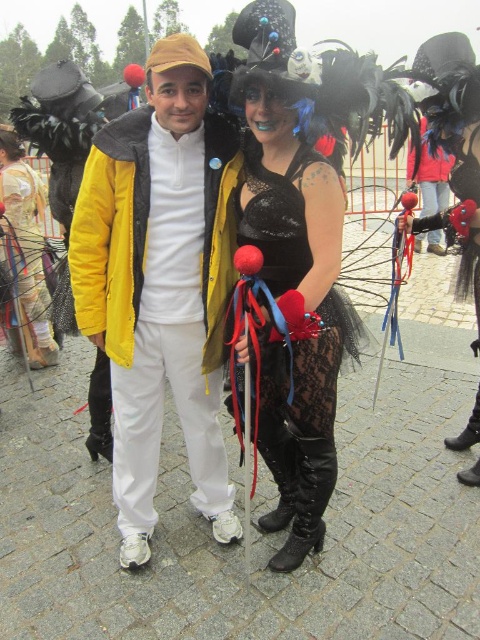
Question: Where is lace fabric dress at center located in relation to matte gold dress at center in the image?

Choices:
 (A) above
 (B) below

Answer: (B)

Question: Estimate the real-world distances between objects in this image. Which object is farther from the lace fabric dress at center?

Choices:
 (A) matte gold dress at center
 (B) matte yellow jacket at center

Answer: (A)

Question: Which object is the farthest from the matte gold dress at center?

Choices:
 (A) lace fabric dress at center
 (B) matte yellow jacket at center

Answer: (A)

Question: Considering the real-world distances, which object is farthest from the matte gold dress at center?

Choices:
 (A) lace fabric dress at center
 (B) matte yellow jacket at center

Answer: (A)

Question: Can you confirm if matte yellow jacket at center is positioned to the left of matte gold dress at center?

Choices:
 (A) no
 (B) yes

Answer: (A)

Question: Is matte yellow jacket at center further to camera compared to lace fabric dress at center?

Choices:
 (A) yes
 (B) no

Answer: (A)